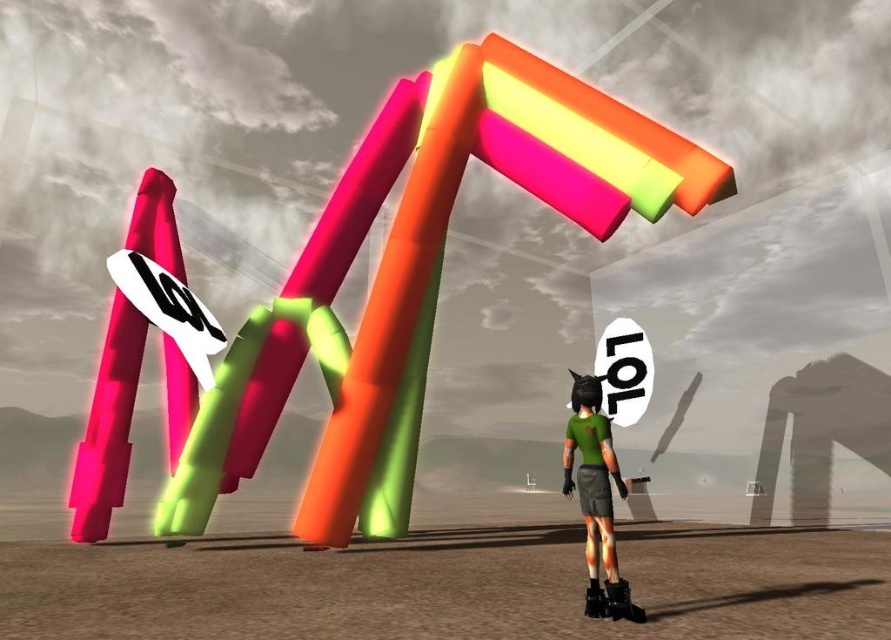
Question: Is neon plastic letters at center smaller than neon plastic sign at center?

Choices:
 (A) no
 (B) yes

Answer: (A)

Question: Is neon plastic letters at center positioned in front of matte pink pole at left?

Choices:
 (A) no
 (B) yes

Answer: (B)

Question: Considering the real-world distances, which object is closest to the green matte shirt at center?

Choices:
 (A) matte pink pole at left
 (B) neon plastic letters at center
 (C) neon plastic sign at center

Answer: (B)

Question: Considering the real-world distances, which object is farthest from the neon plastic letters at center?

Choices:
 (A) matte pink pole at left
 (B) neon plastic sign at center

Answer: (A)

Question: Can you confirm if neon plastic sign at center is thinner than matte pink pole at left?

Choices:
 (A) yes
 (B) no

Answer: (B)

Question: Among these objects, which one is farthest from the camera?

Choices:
 (A) neon plastic letters at center
 (B) neon plastic sign at center

Answer: (B)